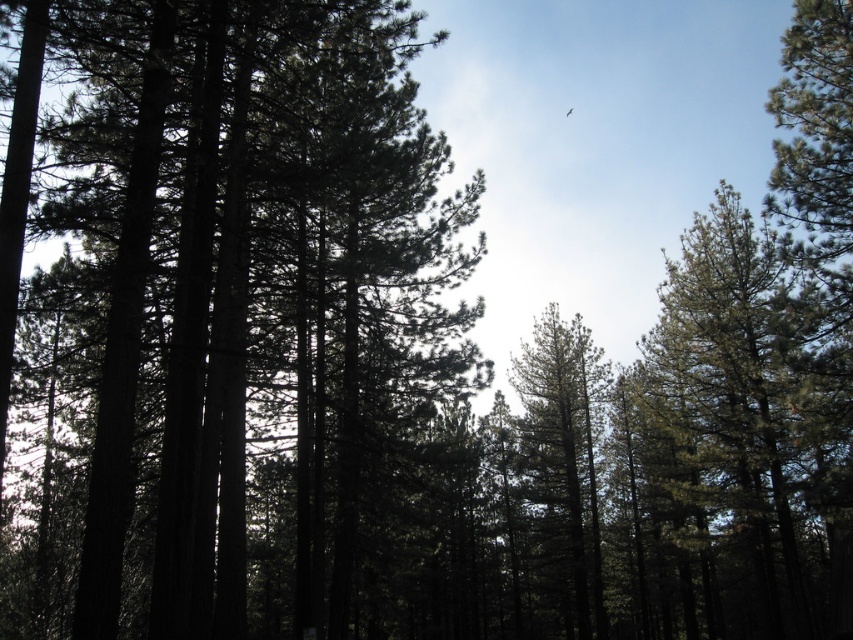
You are a hiker standing in the forest and want to take a photo of both the dark green pine trees at center and the green matte tree at center. Which tree should you focus on first if you want to capture the larger one in your frame?

The dark green pine trees at center is larger in size than the green matte tree at center, so you should focus on the dark green pine trees at center first to capture the larger one in your frame.

You are a bird flying through the forest and want to land on a tree. You see the dark green pine trees at center and the green matte tree at center. Which tree is higher up in the air that you can perch on?

The dark green pine trees at center is located above the green matte tree at center, so you can perch on the dark green pine trees at center which is higher up in the air.

You are standing in the forest looking up at the trees. There are two points marked in the scene, one at coordinates point (238, 605) and the other at point (567, 552). Which point is closer to you?

Point (238, 605) is in front of point (567, 552), so it is closer to you.